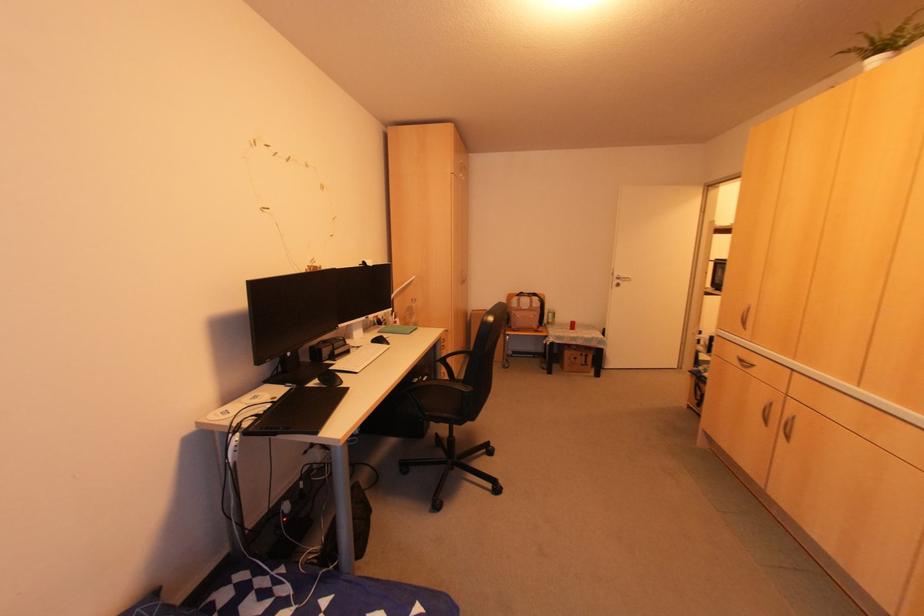
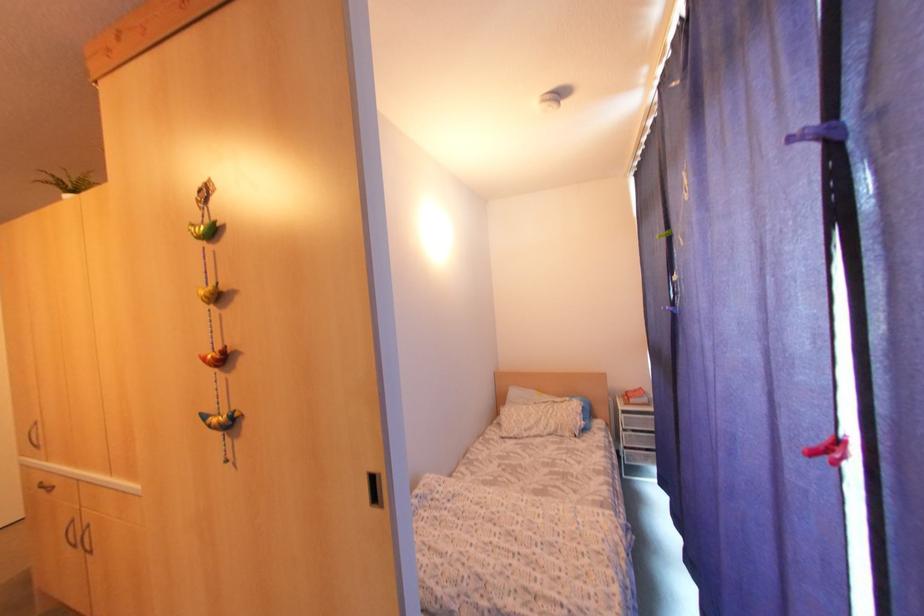
Locate, in the second image, the point that corresponds to point (742, 359) in the first image.

(45, 483)